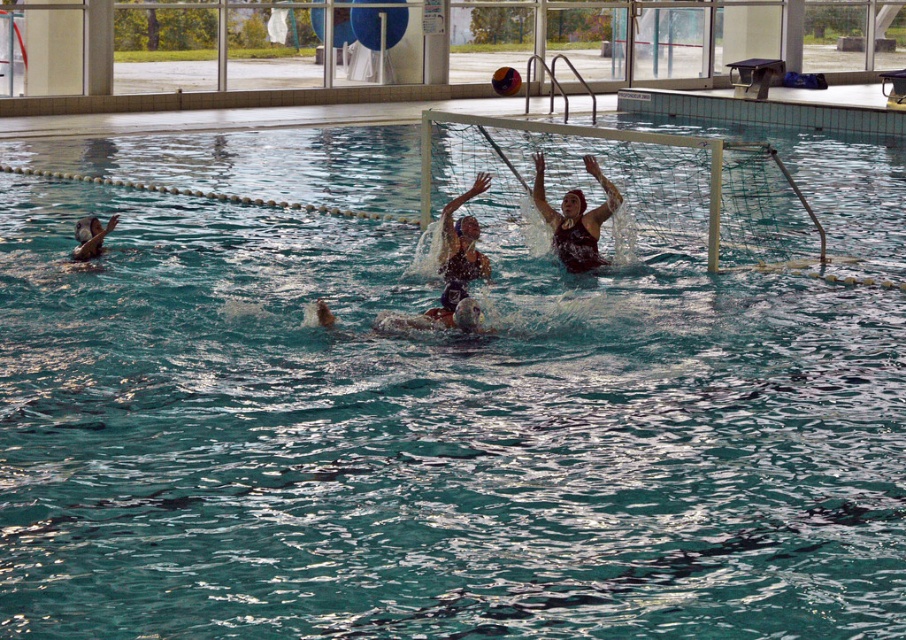
Question: Considering the relative positions of dark brown swimsuit at upper center and smooth skin face at lower left in the image provided, where is dark brown swimsuit at upper center located with respect to smooth skin face at lower left?

Choices:
 (A) above
 (B) below

Answer: (A)

Question: Can you confirm if dark brown swimsuit at upper center is positioned below smooth skin face at lower left?

Choices:
 (A) no
 (B) yes

Answer: (A)

Question: Which of the following is the farthest from the observer?

Choices:
 (A) (83, 248)
 (B) (565, 211)

Answer: (B)

Question: Observing the image, what is the correct spatial positioning of dark brown swimsuit at upper center in reference to smooth skin face at lower left?

Choices:
 (A) above
 (B) below

Answer: (A)

Question: Which point is farther from the camera taking this photo?

Choices:
 (A) (585, 262)
 (B) (87, 250)

Answer: (A)